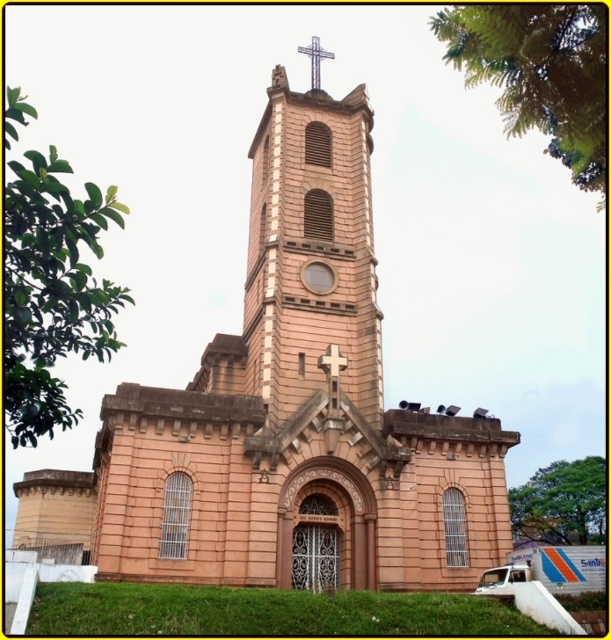
You are standing at the entrance of the church and looking towards the tower. There are two points marked in the image, point 1 at coordinates point (306, 275) and point 2 at coordinates point (323, 362). Which point is closer to you?

Point (323, 362) is closer to you because it is in front of point (306, 275).

You are standing in front of the church and want to locate the matte brown clock at center. Which direction should you look to find it?

The matte brown clock at center is located at point 0.433 on the horizontal axis and 0.520 on the vertical axis, so you should look directly at the center of the church facade to find it.

You are an architect designing a new garden layout around the pink stone church at center and the wooden cross at center. You need to ensure that the garden path is wide enough to accommodate both structures. Based on their widths, which structure requires a wider path?

The pink stone church at center requires a wider path because its width surpasses that of the wooden cross at center.